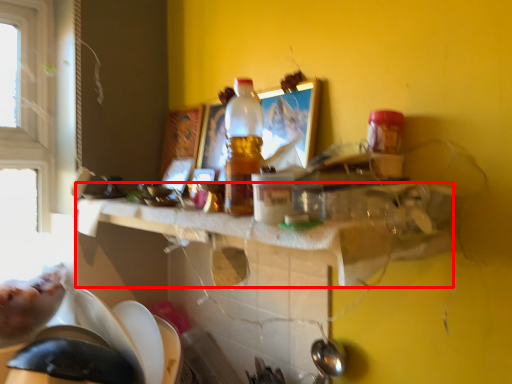
Question: Where is counter top (annotated by the red box) located in relation to bottle in the image?

Choices:
 (A) right
 (B) left

Answer: (B)